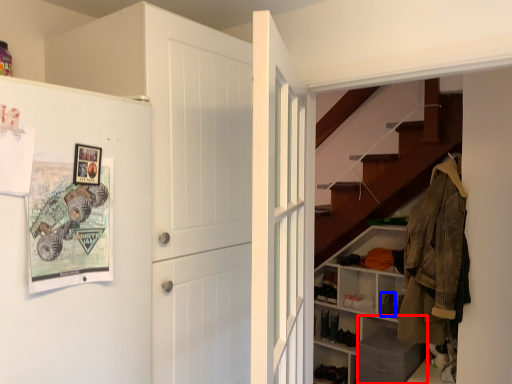
Question: Among these objects, which one is nearest to the camera, shelf (highlighted by a red box) or shoe (highlighted by a blue box)?

Choices:
 (A) shelf
 (B) shoe

Answer: (A)